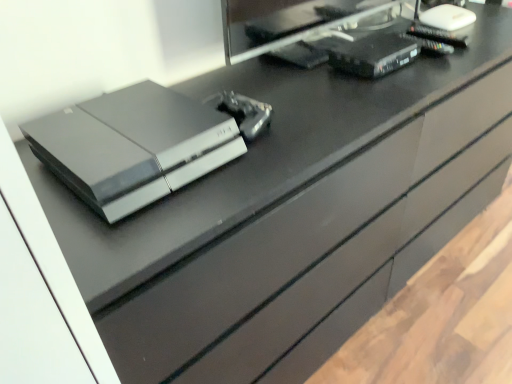
Question: Are black plastic desktop computer at upper right and metallic silver controller at center, the 2th equipment viewed from the back, making contact?

Choices:
 (A) no
 (B) yes

Answer: (A)

Question: Considering the relative sizes of black plastic desktop computer at upper right and metallic silver controller at center, which is counted as the first equipment, starting from the front, in the image provided, is black plastic desktop computer at upper right bigger than metallic silver controller at center, which is counted as the first equipment, starting from the front,?

Choices:
 (A) yes
 (B) no

Answer: (A)

Question: Does black plastic desktop computer at upper right have a greater height compared to metallic silver controller at center, which is the 1th equipment in left-to-right order?

Choices:
 (A) no
 (B) yes

Answer: (B)

Question: Is black plastic desktop computer at upper right facing away from metallic silver controller at center, the 2th equipment when ordered from top to bottom?

Choices:
 (A) yes
 (B) no

Answer: (B)

Question: Can you confirm if black plastic desktop computer at upper right is wider than metallic silver controller at center, which is the 1th equipment in left-to-right order?

Choices:
 (A) yes
 (B) no

Answer: (B)

Question: Considering the positions of satin black console at center and black plastic router at upper right, which ranks as the second equipment in front-to-back order, in the image, is satin black console at center wider or thinner than black plastic router at upper right, which ranks as the second equipment in front-to-back order,?

Choices:
 (A) wide
 (B) thin

Answer: (A)

Question: From a real-world perspective, is satin black console at center above or below black plastic router at upper right, positioned as the 1th equipment in back-to-front order?

Choices:
 (A) below
 (B) above

Answer: (B)

Question: From the image's perspective, is satin black console at center above or below black plastic router at upper right, which is the first equipment from top to bottom?

Choices:
 (A) below
 (B) above

Answer: (A)

Question: Is satin black console at center in front of or behind black plastic router at upper right, which ranks as the 2th equipment in left-to-right order, in the image?

Choices:
 (A) behind
 (B) front

Answer: (B)

Question: Is point (249, 120) closer or farther from the camera than point (373, 13)?

Choices:
 (A) closer
 (B) farther

Answer: (A)

Question: From the image's perspective, is metallic silver controller at center, the second equipment from the right, positioned above or below black plastic desktop computer at upper right?

Choices:
 (A) above
 (B) below

Answer: (B)

Question: In the image, is metallic silver controller at center, the second equipment from the right, positioned in front of or behind black plastic desktop computer at upper right?

Choices:
 (A) front
 (B) behind

Answer: (A)

Question: Choose the correct answer: Is metallic silver controller at center, the second equipment from the right, inside black plastic desktop computer at upper right or outside it?

Choices:
 (A) inside
 (B) outside

Answer: (B)

Question: Based on their positions, is black plastic desktop computer at upper right located to the left or right of satin black console at center?

Choices:
 (A) right
 (B) left

Answer: (A)

Question: Considering the positions of black plastic desktop computer at upper right and satin black console at center in the image, is black plastic desktop computer at upper right taller or shorter than satin black console at center?

Choices:
 (A) short
 (B) tall

Answer: (B)